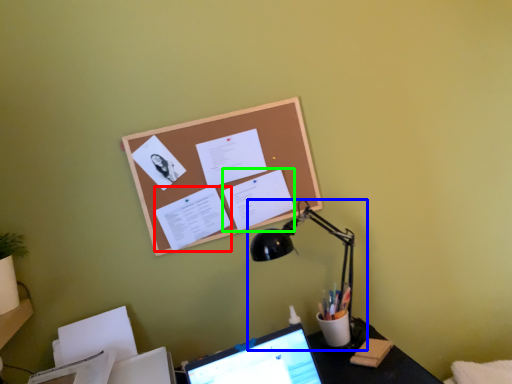
Question: Considering the real-world distances, which object is farthest from document (highlighted by a red box)? lamp (highlighted by a blue box) or document (highlighted by a green box)?

Choices:
 (A) lamp
 (B) document

Answer: (A)